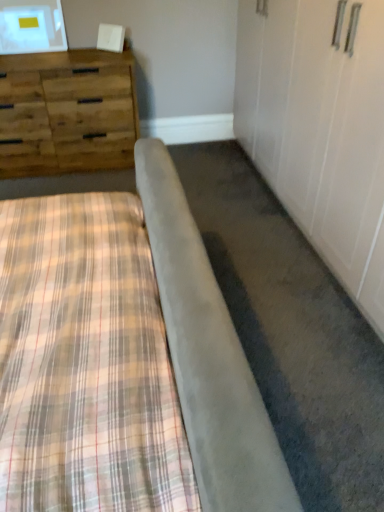
Question: Considering the positions of point tap(33, 161) and point tap(201, 321), is point tap(33, 161) closer or farther from the camera than point tap(201, 321)?

Choices:
 (A) closer
 (B) farther

Answer: (B)

Question: From the image's perspective, is woodenmaterial/texturechest of drawers at upper left positioned above or below plaid fabric bed at lower left?

Choices:
 (A) above
 (B) below

Answer: (A)

Question: Is woodenmaterial/texturechest of drawers at upper left inside the boundaries of plaid fabric bed at lower left, or outside?

Choices:
 (A) outside
 (B) inside

Answer: (A)

Question: Based on their sizes in the image, would you say plaid fabric bed at lower left is bigger or smaller than woodenmaterial/texturechest of drawers at upper left?

Choices:
 (A) big
 (B) small

Answer: (A)

Question: From the image's perspective, is plaid fabric bed at lower left positioned above or below woodenmaterial/texturechest of drawers at upper left?

Choices:
 (A) above
 (B) below

Answer: (B)

Question: In terms of width, does plaid fabric bed at lower left look wider or thinner when compared to woodenmaterial/texturechest of drawers at upper left?

Choices:
 (A) thin
 (B) wide

Answer: (B)

Question: Is point (180, 355) positioned closer to the camera than point (0, 161)?

Choices:
 (A) closer
 (B) farther

Answer: (A)